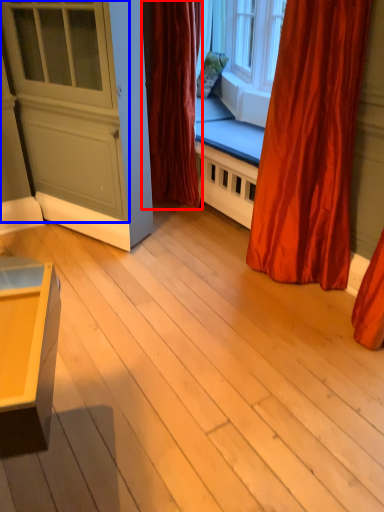
Question: Which point is closer to the camera, curtain (highlighted by a red box) or screen door (highlighted by a blue box)?

Choices:
 (A) curtain
 (B) screen door

Answer: (B)